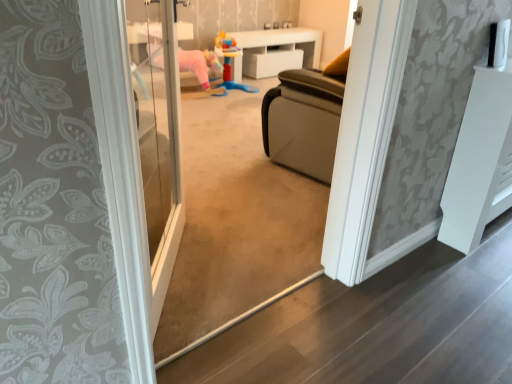
Identify the location of white glossy cabinet at upper center, the first furniture when ordered from back to front. (276, 51).

Identify the location of white matte radiator at right, marked as the second furniture in a left-to-right arrangement. (480, 160).

The width and height of the screenshot is (512, 384). I want to click on furniture located underneath the plastic colorful toy at center (from a real-world perspective), so click(276, 51).

Is plastic colorful toy at center facing away from white glossy cabinet at upper center, the second furniture positioned from the front?

plastic colorful toy at center is not turned away from white glossy cabinet at upper center, the second furniture positioned from the front.

Measure the distance between plastic colorful toy at center and white glossy cabinet at upper center, the second furniture positioned from the front.

plastic colorful toy at center and white glossy cabinet at upper center, the second furniture positioned from the front, are 17.20 inches apart.

From the picture: Which object is further away from the camera taking this photo, white glossy cabinet at upper center, the second furniture in the right-to-left sequence, or plastic colorful toy at center?

white glossy cabinet at upper center, the second furniture in the right-to-left sequence, is behind.

Consider the image. Which point is more forward, (256,61) or (216,38)?

The point (216,38) is closer.

From a real-world perspective, which is physically above, white glossy cabinet at upper center, the second furniture in the right-to-left sequence, or plastic colorful toy at center?

plastic colorful toy at center, from a real-world perspective.

The image size is (512, 384). I want to click on furniture above the plastic colorful toy at center (from the image's perspective), so click(x=276, y=51).

Between white matte radiator at right, which appears as the 2th furniture when viewed from the back, and plastic colorful toy at center, which one has more height?

white matte radiator at right, which appears as the 2th furniture when viewed from the back.

In terms of width, does white matte radiator at right, marked as the second furniture in a left-to-right arrangement, look wider or thinner when compared to plastic colorful toy at center?

white matte radiator at right, marked as the second furniture in a left-to-right arrangement, is thinner than plastic colorful toy at center.

From the image's perspective, does white matte radiator at right, marked as the 2th furniture in a top-to-bottom arrangement, appear lower than plastic colorful toy at center?

Correct, white matte radiator at right, marked as the 2th furniture in a top-to-bottom arrangement, appears lower than plastic colorful toy at center in the image.

From a real-world perspective, who is located lower, white matte radiator at right, the first furniture in the right-to-left sequence, or white glossy cabinet at upper center, which is the 1th furniture in left-to-right order?

white glossy cabinet at upper center, which is the 1th furniture in left-to-right order, is physically lower.

Looking at the image, does white matte radiator at right, marked as the 2th furniture in a top-to-bottom arrangement, seem bigger or smaller compared to white glossy cabinet at upper center, the 1th furniture positioned from the top?

Considering their sizes, white matte radiator at right, marked as the 2th furniture in a top-to-bottom arrangement, takes up less space than white glossy cabinet at upper center, the 1th furniture positioned from the top.

From the image's perspective, between white matte radiator at right, marked as the second furniture in a left-to-right arrangement, and white glossy cabinet at upper center, the first furniture when ordered from back to front, who is located below?

white matte radiator at right, marked as the second furniture in a left-to-right arrangement.

Can you confirm if white matte radiator at right, the first furniture in the right-to-left sequence, is wider than white glossy cabinet at upper center, the 1th furniture positioned from the top?

No, white matte radiator at right, the first furniture in the right-to-left sequence, is not wider than white glossy cabinet at upper center, the 1th furniture positioned from the top.

In the scene shown: Considering the sizes of objects plastic colorful toy at center and white matte radiator at right, which ranks as the first furniture in front-to-back order, in the image provided, who is smaller, plastic colorful toy at center or white matte radiator at right, which ranks as the first furniture in front-to-back order,?

Smaller between the two is plastic colorful toy at center.

Based on the photo, looking at their sizes, would you say plastic colorful toy at center is wider or thinner than white matte radiator at right, the first furniture ordered from the bottom?

Clearly, plastic colorful toy at center has more width compared to white matte radiator at right, the first furniture ordered from the bottom.

Who is taller, plastic colorful toy at center or white matte radiator at right, which appears as the 2th furniture when viewed from the back?

white matte radiator at right, which appears as the 2th furniture when viewed from the back, is taller.

From a real-world perspective, does plastic colorful toy at center stand above white matte radiator at right, which appears as the 2th furniture when viewed from the back?

Incorrect, from a real-world perspective, plastic colorful toy at center is lower than white matte radiator at right, which appears as the 2th furniture when viewed from the back.

Do you think white glossy cabinet at upper center, the second furniture in the right-to-left sequence, is within white matte radiator at right, which ranks as the first furniture in front-to-back order, or outside of it?

white glossy cabinet at upper center, the second furniture in the right-to-left sequence, is not inside white matte radiator at right, which ranks as the first furniture in front-to-back order, it's outside.

Considering the positions of point (253, 72) and point (497, 68), is point (253, 72) closer or farther from the camera than point (497, 68)?

Point (253, 72) appears to be farther away from the viewer than point (497, 68).

Where is `furniture above the white glossy cabinet at upper center, the second furniture in the right-to-left sequence (from a real-world perspective)`? The width and height of the screenshot is (512, 384). furniture above the white glossy cabinet at upper center, the second furniture in the right-to-left sequence (from a real-world perspective) is located at coordinates (480, 160).

Which object is further away from the camera, white glossy cabinet at upper center, the 1th furniture positioned from the top, or white matte radiator at right, which ranks as the first furniture in front-to-back order?

white glossy cabinet at upper center, the 1th furniture positioned from the top, is more distant.

You are a GUI agent. You are given a task and a screenshot of the screen. Output one action in this format:
    pyautogui.click(x=<x>, y=<y>)
    Task: Click on the furniture directly beneath the plastic colorful toy at center (from a real-world perspective)
    Image resolution: width=512 pixels, height=384 pixels.
    Given the screenshot: What is the action you would take?
    pyautogui.click(x=276, y=51)

Image resolution: width=512 pixels, height=384 pixels. I want to click on toy above the white glossy cabinet at upper center, which is the 2th furniture in bottom-to-top order (from a real-world perspective), so click(229, 64).

When comparing their distances from white glossy cabinet at upper center, the second furniture in the right-to-left sequence, does white matte radiator at right, marked as the second furniture in a left-to-right arrangement, or plastic colorful toy at center seem closer?

The object closer to white glossy cabinet at upper center, the second furniture in the right-to-left sequence, is plastic colorful toy at center.

Estimate the real-world distances between objects in this image. Which object is closer to plastic colorful toy at center, white matte radiator at right, which ranks as the first furniture in front-to-back order, or white glossy cabinet at upper center, the second furniture in the right-to-left sequence?

white glossy cabinet at upper center, the second furniture in the right-to-left sequence, lies closer to plastic colorful toy at center than the other object.

From the image, which object appears to be nearer to plastic colorful toy at center, white glossy cabinet at upper center, the second furniture in the right-to-left sequence, or white matte radiator at right, the first furniture ordered from the bottom?

white glossy cabinet at upper center, the second furniture in the right-to-left sequence, is positioned closer to the anchor plastic colorful toy at center.

From the image, which object appears to be nearer to white matte radiator at right, which appears as the 2th furniture when viewed from the back, white glossy cabinet at upper center, the 1th furniture positioned from the top, or plastic colorful toy at center?

plastic colorful toy at center is positioned closer to the anchor white matte radiator at right, which appears as the 2th furniture when viewed from the back.

Estimate the real-world distances between objects in this image. Which object is further from white matte radiator at right, marked as the 2th furniture in a top-to-bottom arrangement, plastic colorful toy at center or white glossy cabinet at upper center, which is the 1th furniture in left-to-right order?

Based on the image, white glossy cabinet at upper center, which is the 1th furniture in left-to-right order, appears to be further to white matte radiator at right, marked as the 2th furniture in a top-to-bottom arrangement.

Which object lies nearer to the anchor point white glossy cabinet at upper center, the second furniture in the right-to-left sequence, plastic colorful toy at center or white matte radiator at right, marked as the 2th furniture in a top-to-bottom arrangement?

plastic colorful toy at center is positioned closer to the anchor white glossy cabinet at upper center, the second furniture in the right-to-left sequence.

Find the location of a particular element. toy located between white matte radiator at right, marked as the 2th furniture in a top-to-bottom arrangement, and white glossy cabinet at upper center, the second furniture positioned from the front, in the depth direction is located at coordinates (229, 64).